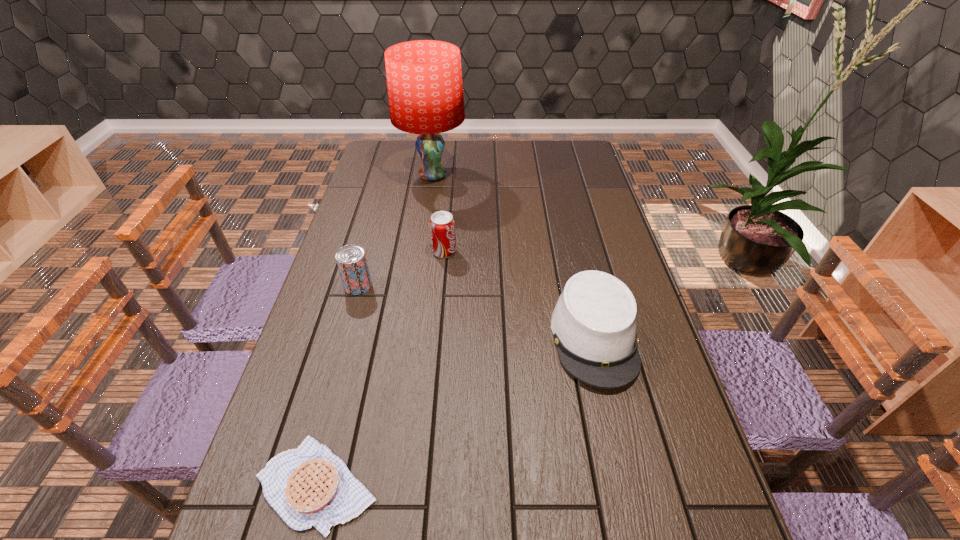
Find the location of `lampshade`. lampshade is located at coordinates [x=424, y=77].

Locate an element on the screen. the farthest object is located at coordinates (424, 77).

Find the location of a particular element. This screenshot has width=960, height=540. the second farthest object is located at coordinates (442, 225).

Locate an element on the screen. beer can is located at coordinates (351, 260).

Locate an element on the screen. the rightmost object is located at coordinates (594, 326).

Identify the location of the shortest object. The width and height of the screenshot is (960, 540). (309, 486).

Image resolution: width=960 pixels, height=540 pixels. In order to click on the nearest object in this screenshot , I will do `click(309, 486)`.

At what (x,y) coordinates should I click in order to perform the action: click on vacant space located on the front-facing side of the lampshade. Please return your answer as a coordinate pair (x, y). The width and height of the screenshot is (960, 540). Looking at the image, I should click on (422, 243).

Find the location of a particular element. vacant space located 0.150m on the left of the fourth nearest object is located at coordinates (385, 252).

Find the location of `vacant space located 0.170m on the front of the beer can`. vacant space located 0.170m on the front of the beer can is located at coordinates (342, 344).